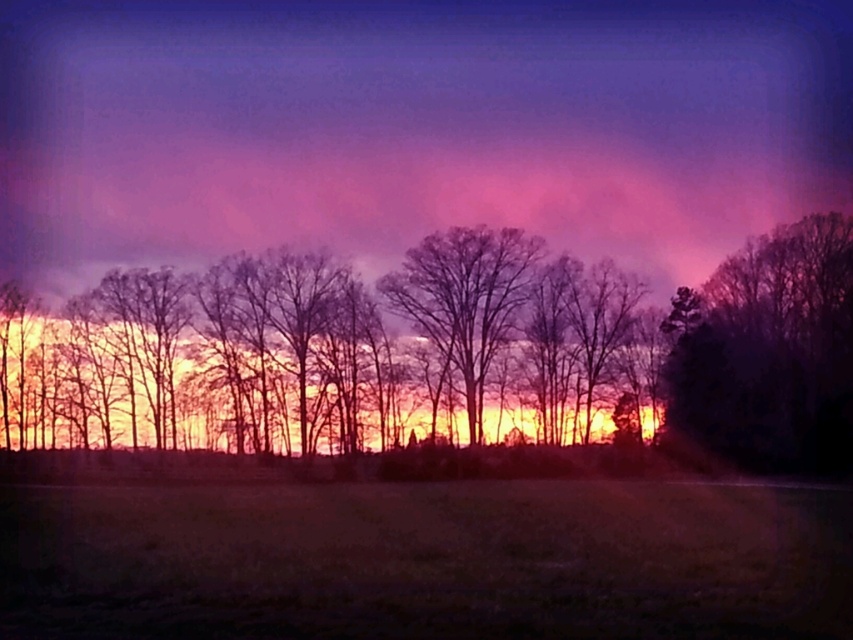
You are an artist trying to paint this sunset scene. You want to place the dark green textured tree at right and the bare branches at center in your painting. Based on the scene, which object should you paint first if you follow the standard painting technique of starting with the background elements?

You should paint the dark green textured tree at right first because it is positioned to the right of the bare branches at center, meaning it is further back in the scene and should be painted before the foreground elements.

You are standing in the sunset scene and want to place a small decorative stone between the two points, point [604,97] and point [746,419]. Which point should the stone be closer to if you want it to appear closer to the camera?

The stone should be placed closer to point [604,97] because it is further to the camera than point [746,419]. Since point [604,97] is closer to the viewer, placing the stone near it would make the stone appear closer to the camera.

You are an artist trying to paint this sunset scene. You want to ensure the purple cotton candy cloud at upper center and the dark green textured tree at right are proportionally accurate. Which object should you paint taller in your artwork?

The purple cotton candy cloud at upper center should be painted taller than the dark green textured tree at right because the description states it has a greater height.